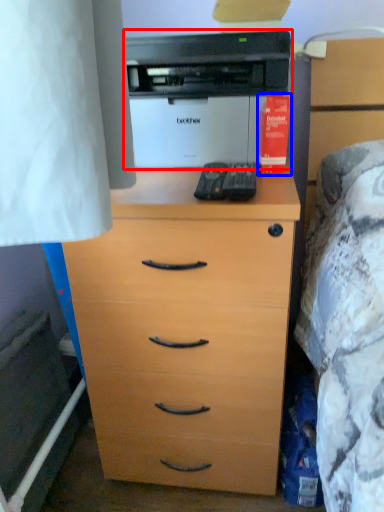
Question: Which of the following is the closest to the observer, printer (highlighted by a red box) or book (highlighted by a blue box)?

Choices:
 (A) printer
 (B) book

Answer: (A)